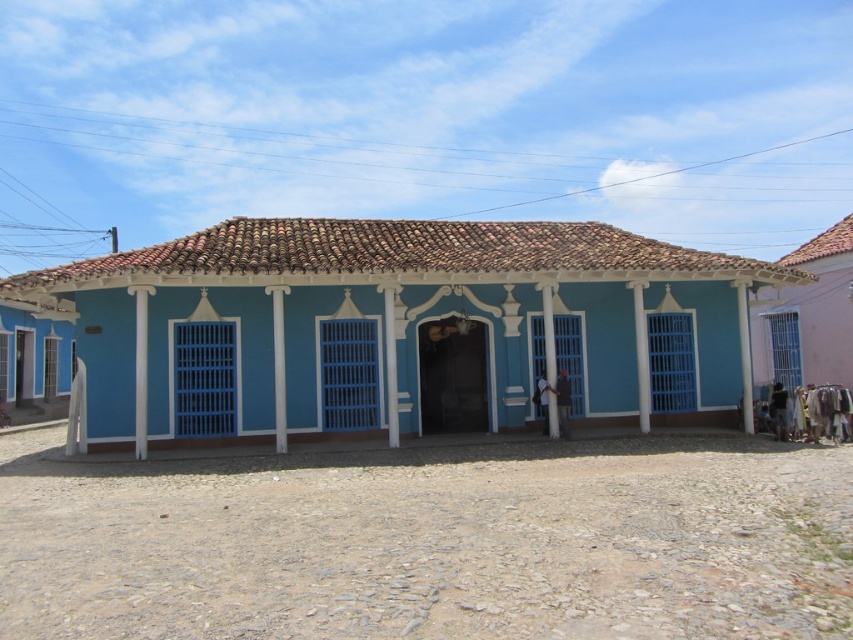
Can you confirm if blue painted wood house at center is bigger than pink fabric at right?

No.

Which is more to the left, blue painted wood house at center or pink fabric at right?

blue painted wood house at center is more to the left.

Measure the distance between point (173, 388) and camera.

They are 50.21 feet apart.

I want to click on blue painted wood house at center, so click(x=397, y=326).